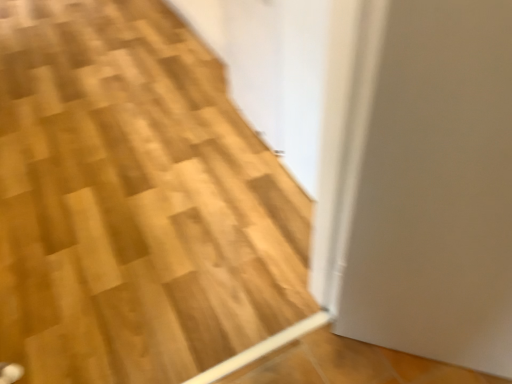
This screenshot has height=384, width=512. Find the location of `wooden at lower left`. wooden at lower left is located at coordinates (134, 201).

What is the approximate height of wooden at lower left?

wooden at lower left is 6.32 centimeters tall.

What do you see at coordinates (134, 201) in the screenshot? I see `wooden at lower left` at bounding box center [134, 201].

Where is `wooden at lower left`? wooden at lower left is located at coordinates (134, 201).